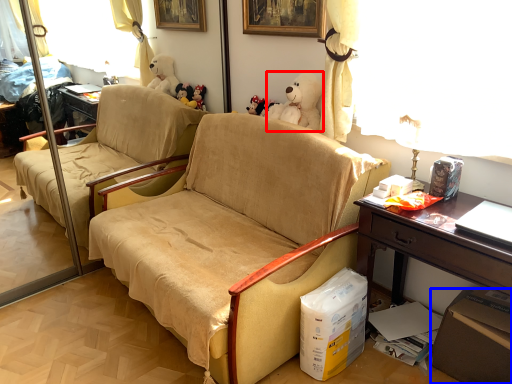
Question: Which of the following is the closest to the observer, toy (highlighted by a red box) or box (highlighted by a blue box)?

Choices:
 (A) toy
 (B) box

Answer: (B)